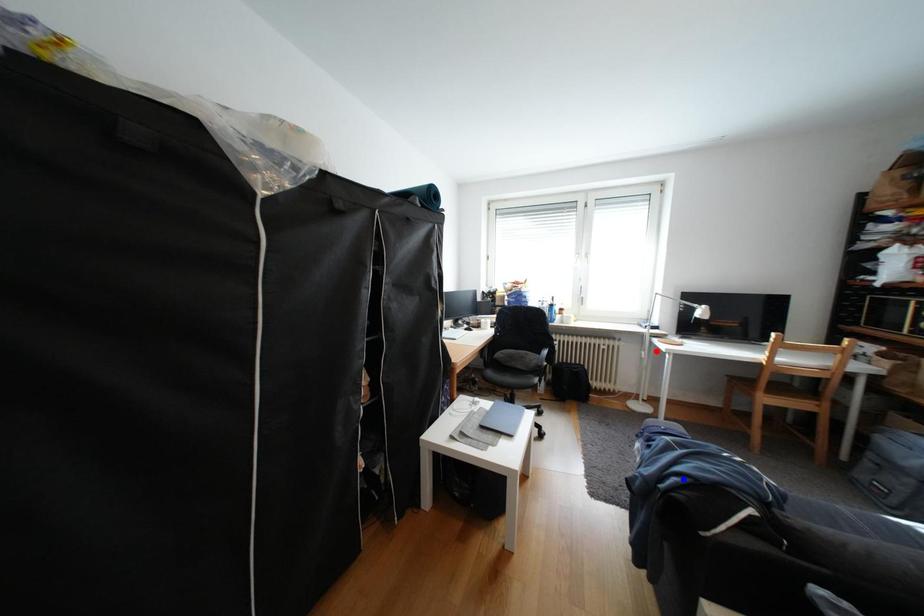
Question: In the image, two points are highlighted. Which point is nearer to the camera? Reply with the corresponding letter.

Choices:
 (A) blue point
 (B) red point

Answer: (A)